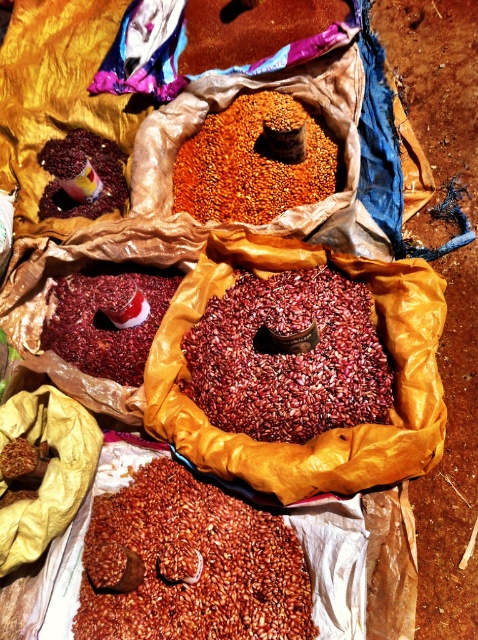
You are a farmer who wants to determine which object is wider between the dark red grain at center and the shiny plastic cup at upper left. Based on the scene, which one is wider?

The dark red grain at center is wider than the shiny plastic cup at upper left according to the description.

You are a farmer inspecting sacks of grains. You notice two sacks with central cylindrical objects. One has brown matte beans at center and the other has dark red grain at center. Which sack has the cylindrical object that is lower in position?

The brown matte beans at center is positioned under dark red grain at center, so the sack with brown matte beans at center has the cylindrical object that is lower in position.